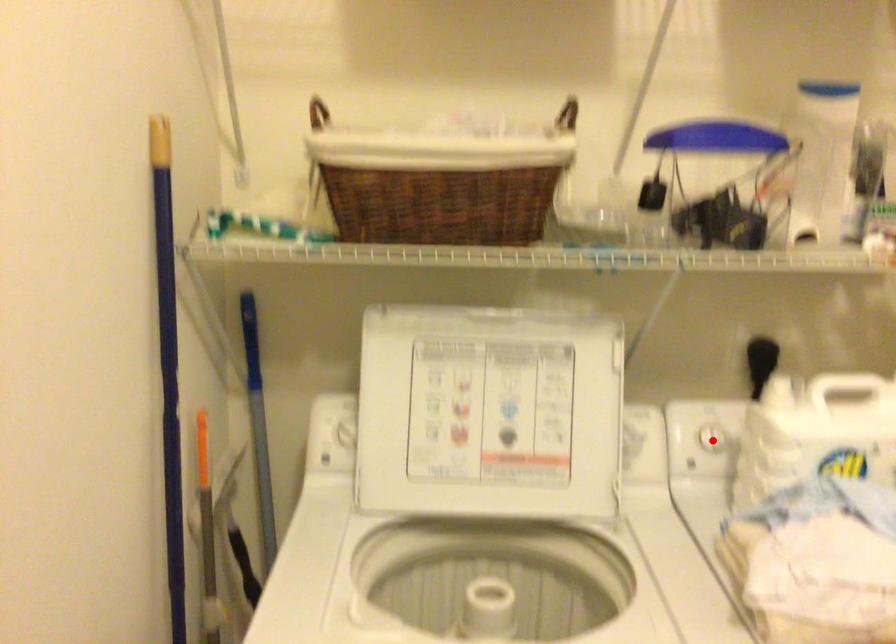
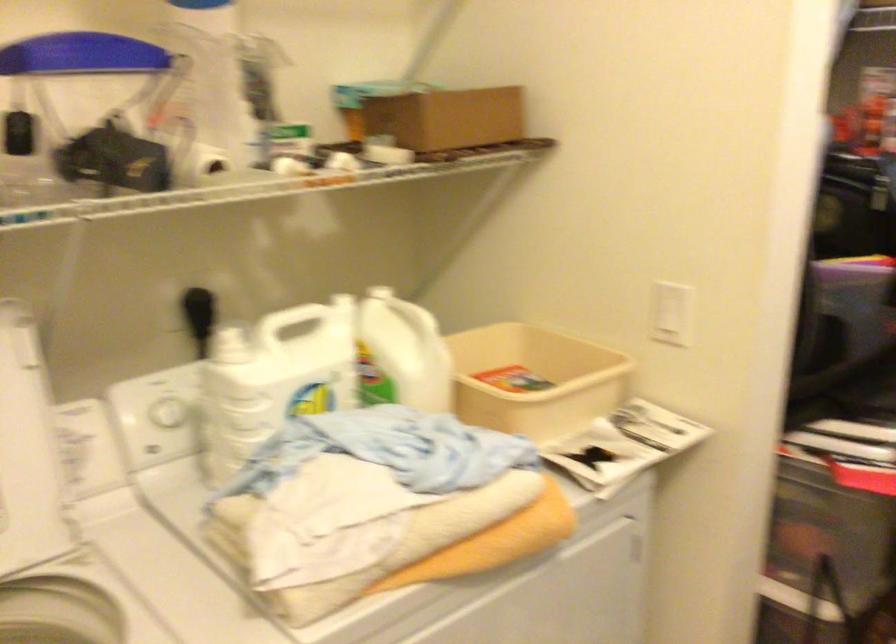
Question: I am providing you with two images of the same scene from different viewpoints. Image1 has a red point marked. In image2, the corresponding 3D location appears at what relative position? Reply with the corresponding letter.

Choices:
 (A) Closer
 (B) Farther

Answer: (A)